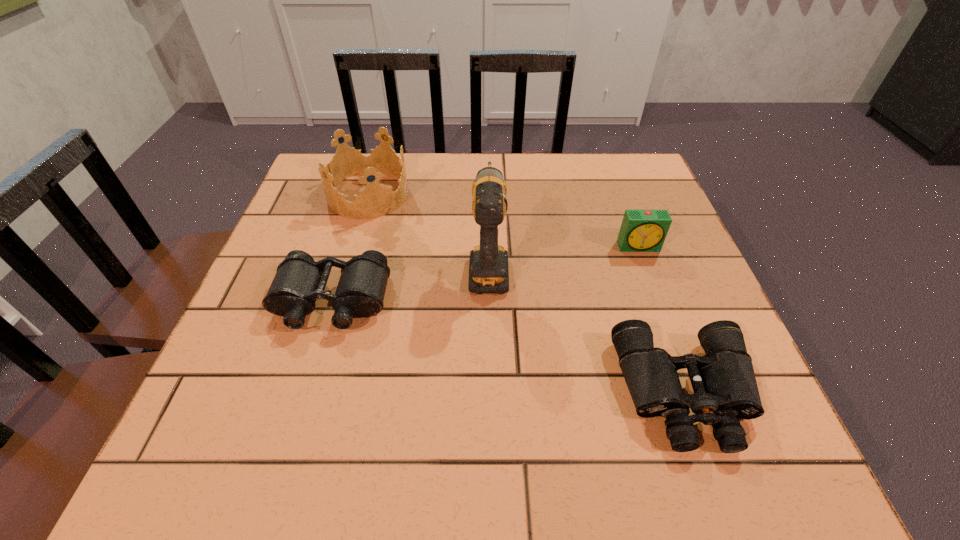
Choose which object is the fourth nearest neighbor to the nearest object. Please provide its 2D coordinates. Your answer should be formatted as a tuple, i.e. [(x, y)], where the tuple contains the x and y coordinates of a point satisfying the conditions above.

[(375, 200)]

You are a GUI agent. You are given a task and a screenshot of the screen. Output one action in this format:
    pyautogui.click(x=<x>, y=<y>)
    Task: Click on the vacant region that satisfies the following two spatial constraints: 1. on the front-facing side of the tiara; 2. through the eyepieces of the left binoculars
    
    Given the screenshot: What is the action you would take?
    pyautogui.click(x=335, y=301)